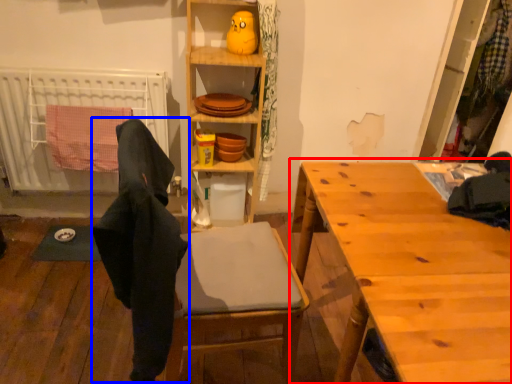
Question: Which object is further to the camera taking this photo, table (highlighted by a red box) or clothing (highlighted by a blue box)?

Choices:
 (A) table
 (B) clothing

Answer: (B)